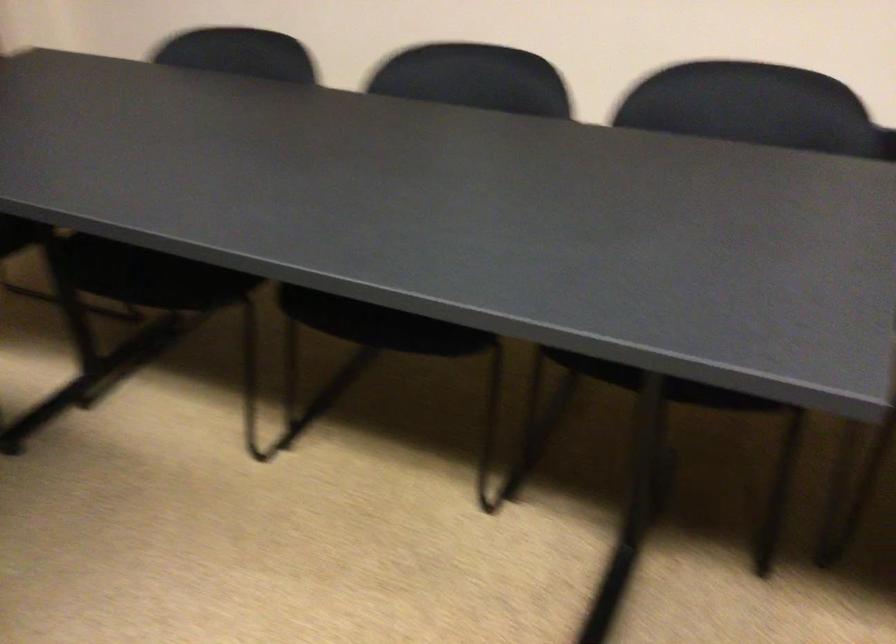
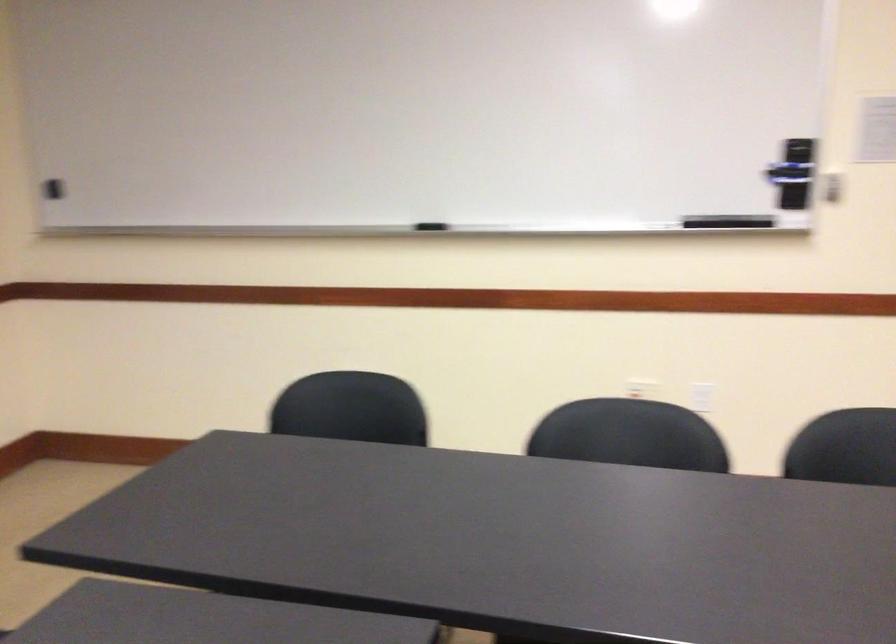
Question: The first image is from the beginning of the video and the second image is from the end. How did the camera likely rotate when shooting the video?

Choices:
 (A) Left
 (B) Right
 (C) Up
 (D) Down

Answer: (A)